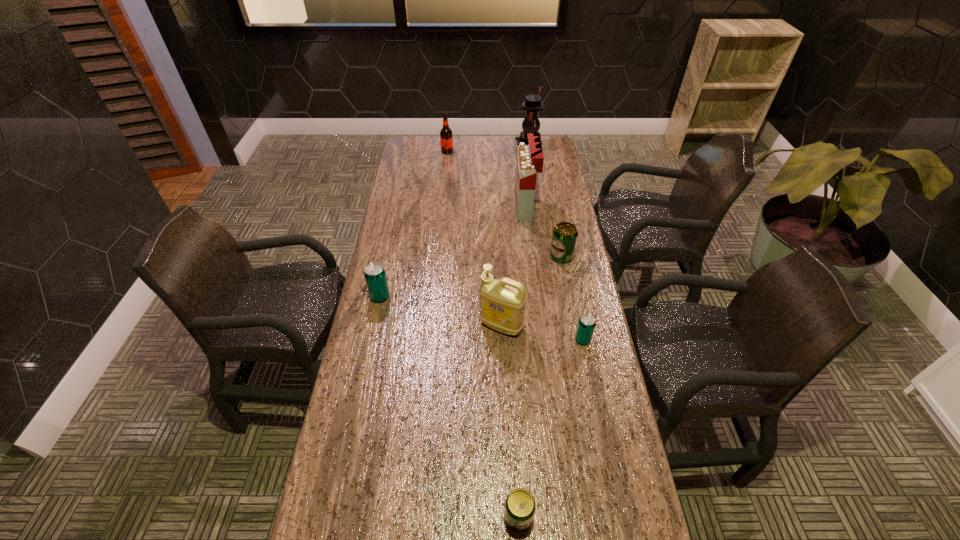
The height and width of the screenshot is (540, 960). Identify the location of lantern present at the right edge. (532, 104).

The height and width of the screenshot is (540, 960). Find the location of `cigarette case located in the right edge section of the desktop`. cigarette case located in the right edge section of the desktop is located at coordinates (530, 158).

I want to click on object present at the far right corner, so click(532, 104).

You are a GUI agent. You are given a task and a screenshot of the screen. Output one action in this format:
    pyautogui.click(x=<x>, y=<y>)
    Task: Click on the free space at the far edge of the desktop
    
    Given the screenshot: What is the action you would take?
    pyautogui.click(x=467, y=160)

This screenshot has width=960, height=540. In the image, there is a desktop. What are the coordinates of `vacant space at the left edge` in the screenshot? It's located at click(x=390, y=320).

In the image, there is a desktop. At what (x,y) coordinates should I click in order to perform the action: click on free space at the right edge. Please return your answer as a coordinate pair (x, y). This screenshot has width=960, height=540. Looking at the image, I should click on (555, 319).

Locate an element on the screen. vacant area that lies between the seventh object from right to left and the sixth nearest object is located at coordinates (487, 180).

Identify the location of free space that is in between the nearer teal beer can and the nearer green beer can. The image size is (960, 540). [x=550, y=428].

Where is `free space between the farther green beer can and the fourth tallest object`? This screenshot has width=960, height=540. free space between the farther green beer can and the fourth tallest object is located at coordinates (504, 204).

Locate an element on the screen. This screenshot has height=540, width=960. blank region between the third farthest beer can and the cigarette case is located at coordinates (554, 274).